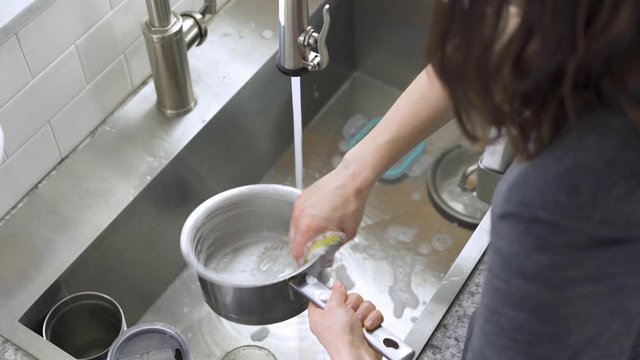
The height and width of the screenshot is (360, 640). Identify the location of the top part of the blue item in the sink. (364, 131).